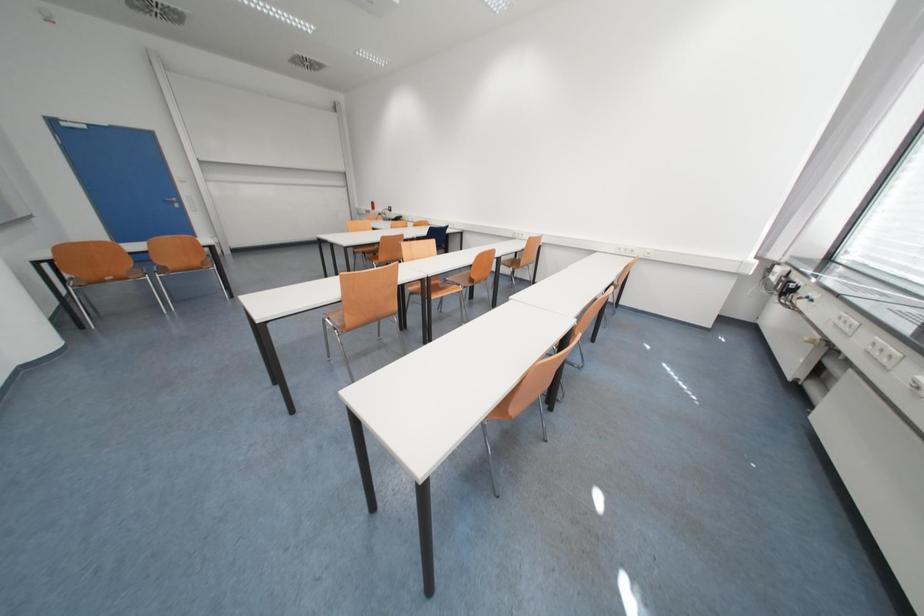
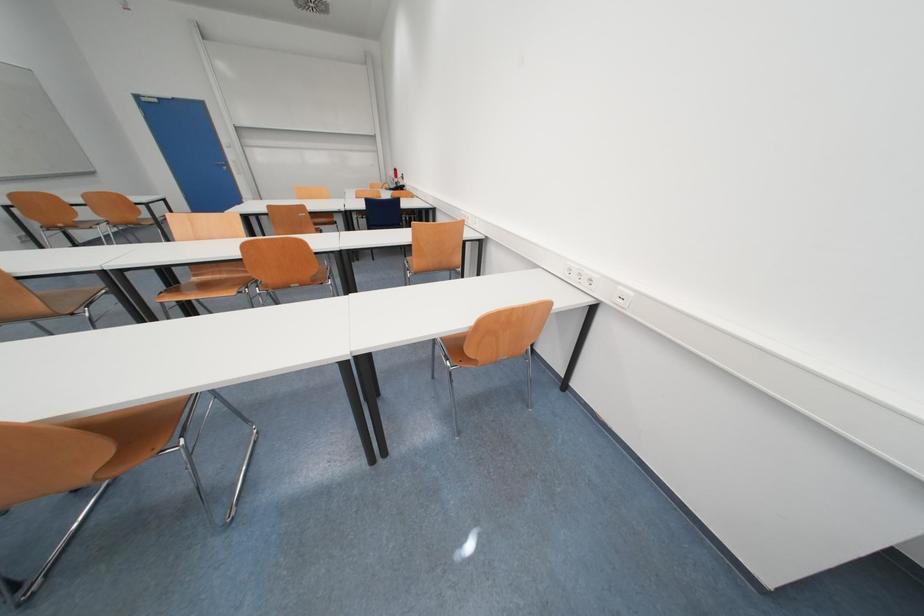
The images are taken continuously from a first-person perspective. In which direction are you moving?

The cameraman walked toward right, forward.